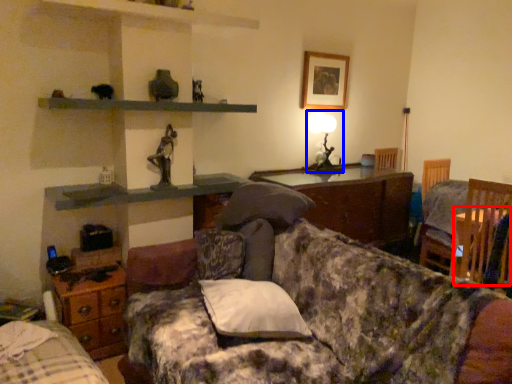
Question: Among these objects, which one is farthest to the camera, table (highlighted by a red box) or table lamp (highlighted by a blue box)?

Choices:
 (A) table
 (B) table lamp

Answer: (B)